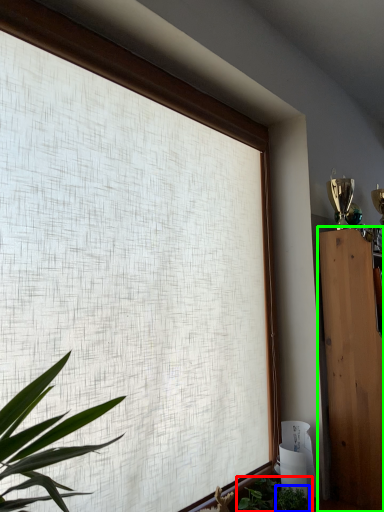
Question: Which object is positioned closest to houseplant (highlighted by a red box)? Select from plant (highlighted by a blue box) and furniture (highlighted by a green box).

Choices:
 (A) plant
 (B) furniture

Answer: (A)